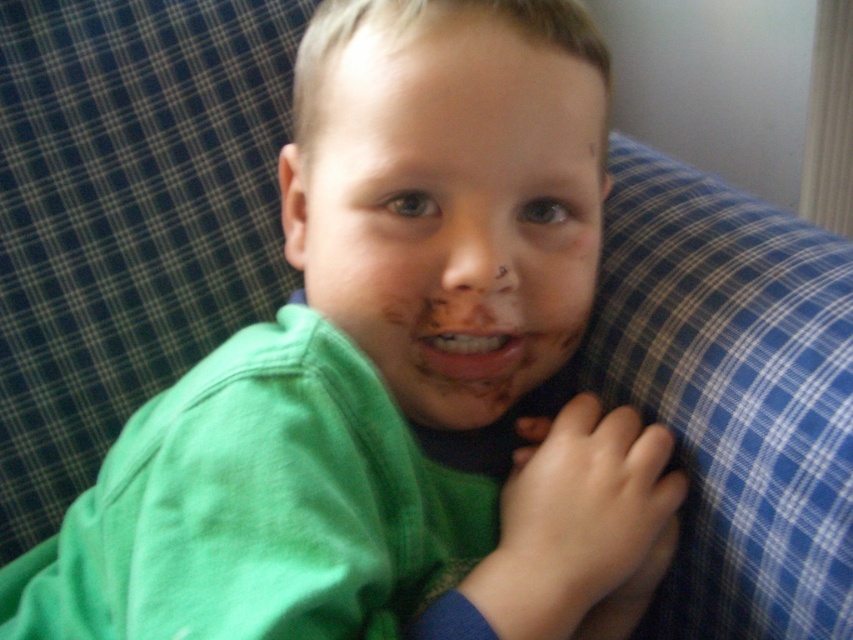
Question: Does chocolate matte face at center have a lesser width compared to smooth chocolate mouth at center?

Choices:
 (A) no
 (B) yes

Answer: (A)

Question: Can you confirm if chocolate matte face at center is smaller than smooth chocolate mouth at center?

Choices:
 (A) yes
 (B) no

Answer: (B)

Question: From the image, what is the correct spatial relationship of chocolate matte face at center in relation to smooth chocolate mouth at center?

Choices:
 (A) below
 (B) above

Answer: (B)

Question: Which object is farther from the camera taking this photo?

Choices:
 (A) chocolate matte face at center
 (B) smooth chocolate mouth at center

Answer: (B)